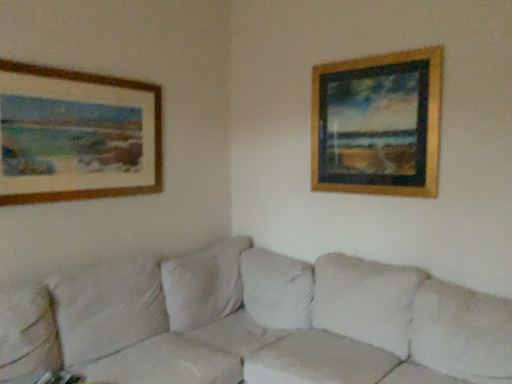
Locate an element on the screen. This screenshot has height=384, width=512. white fabric couch at center is located at coordinates tap(254, 323).

Image resolution: width=512 pixels, height=384 pixels. Find the location of `white fabric couch at center`. white fabric couch at center is located at coordinates (254, 323).

Is wooden picture frame at upper left, placed as the 1th picture frame when sorted from left to right, shorter than white fabric couch at center?

Yes, wooden picture frame at upper left, placed as the 1th picture frame when sorted from left to right, is shorter than white fabric couch at center.

From a real-world perspective, is wooden picture frame at upper left, which is the second picture frame in right-to-left order, positioned above or below white fabric couch at center?

In terms of real-world spatial position, wooden picture frame at upper left, which is the second picture frame in right-to-left order, is above white fabric couch at center.

Is wooden picture frame at upper left, which is the second picture frame in right-to-left order, located outside white fabric couch at center?

Yes.

Is white fabric couch at center spatially inside gold wooden picture frame at upper right, the first picture frame positioned from the right, or outside of it?

white fabric couch at center exists outside the volume of gold wooden picture frame at upper right, the first picture frame positioned from the right.

Find the location of a particular element. studio couch below the gold wooden picture frame at upper right, the 2th picture frame positioned from the left (from the image's perspective) is located at coordinates (254, 323).

Which object is wider, white fabric couch at center or gold wooden picture frame at upper right, the 2th picture frame positioned from the left?

Wider between the two is white fabric couch at center.

Does white fabric couch at center lie behind gold wooden picture frame at upper right, the first picture frame positioned from the right?

That is False.

Is gold wooden picture frame at upper right, the 2th picture frame positioned from the left, inside the boundaries of wooden picture frame at upper left, placed as the 1th picture frame when sorted from left to right, or outside?

gold wooden picture frame at upper right, the 2th picture frame positioned from the left, cannot be found inside wooden picture frame at upper left, placed as the 1th picture frame when sorted from left to right.

Is gold wooden picture frame at upper right, the first picture frame positioned from the right, looking in the opposite direction of wooden picture frame at upper left, placed as the 1th picture frame when sorted from left to right?

No, gold wooden picture frame at upper right, the first picture frame positioned from the right,'s orientation is not away from wooden picture frame at upper left, placed as the 1th picture frame when sorted from left to right.

Which object is positioned more to the right, gold wooden picture frame at upper right, the first picture frame positioned from the right, or wooden picture frame at upper left, which is the second picture frame in right-to-left order?

From the viewer's perspective, gold wooden picture frame at upper right, the first picture frame positioned from the right, appears more on the right side.

What's the angular difference between gold wooden picture frame at upper right, the first picture frame positioned from the right, and wooden picture frame at upper left, placed as the 1th picture frame when sorted from left to right,'s facing directions?

They differ by 90.1 degrees in their facing directions.

Between white fabric couch at center and wooden picture frame at upper left, placed as the 1th picture frame when sorted from left to right, which one has less height?

With less height is wooden picture frame at upper left, placed as the 1th picture frame when sorted from left to right.

Is white fabric couch at center in front of or behind wooden picture frame at upper left, which is the second picture frame in right-to-left order, in the image?

Clearly, white fabric couch at center is in front of wooden picture frame at upper left, which is the second picture frame in right-to-left order.

Would you say white fabric couch at center contains wooden picture frame at upper left, which is the second picture frame in right-to-left order?

No, wooden picture frame at upper left, which is the second picture frame in right-to-left order, is located outside of white fabric couch at center.

From the image's perspective, which is below, white fabric couch at center or wooden picture frame at upper left, placed as the 1th picture frame when sorted from left to right?

white fabric couch at center.

Which object is wider, wooden picture frame at upper left, which is the second picture frame in right-to-left order, or gold wooden picture frame at upper right, the 2th picture frame positioned from the left?

gold wooden picture frame at upper right, the 2th picture frame positioned from the left, is wider.

Does wooden picture frame at upper left, which is the second picture frame in right-to-left order, have a lesser height compared to gold wooden picture frame at upper right, the first picture frame positioned from the right?

Yes, wooden picture frame at upper left, which is the second picture frame in right-to-left order, is shorter than gold wooden picture frame at upper right, the first picture frame positioned from the right.

Where is `picture frame below the gold wooden picture frame at upper right, the first picture frame positioned from the right (from a real-world perspective)`? Image resolution: width=512 pixels, height=384 pixels. picture frame below the gold wooden picture frame at upper right, the first picture frame positioned from the right (from a real-world perspective) is located at coordinates (76, 135).

How many degrees apart are the facing directions of gold wooden picture frame at upper right, the 2th picture frame positioned from the left, and white fabric couch at center?

They differ by 90.7 degrees in their facing directions.

Considering the relative sizes of gold wooden picture frame at upper right, the 2th picture frame positioned from the left, and white fabric couch at center in the image provided, is gold wooden picture frame at upper right, the 2th picture frame positioned from the left, thinner than white fabric couch at center?

Yes.

Where is `studio couch that appears in front of the gold wooden picture frame at upper right, the first picture frame positioned from the right`? The height and width of the screenshot is (384, 512). studio couch that appears in front of the gold wooden picture frame at upper right, the first picture frame positioned from the right is located at coordinates click(x=254, y=323).

I want to click on studio couch in front of the wooden picture frame at upper left, placed as the 1th picture frame when sorted from left to right, so click(x=254, y=323).

In the image, there is a gold wooden picture frame at upper right, the 2th picture frame positioned from the left. Where is `studio couch below it (from a real-world perspective)`? Image resolution: width=512 pixels, height=384 pixels. studio couch below it (from a real-world perspective) is located at coordinates (254, 323).

When comparing their distances from white fabric couch at center, does wooden picture frame at upper left, placed as the 1th picture frame when sorted from left to right, or gold wooden picture frame at upper right, the 2th picture frame positioned from the left, seem closer?

wooden picture frame at upper left, placed as the 1th picture frame when sorted from left to right.

Which object lies nearer to the anchor point wooden picture frame at upper left, placed as the 1th picture frame when sorted from left to right, white fabric couch at center or gold wooden picture frame at upper right, the 2th picture frame positioned from the left?

Among the two, white fabric couch at center is located nearer to wooden picture frame at upper left, placed as the 1th picture frame when sorted from left to right.

Looking at the image, which one is located further to wooden picture frame at upper left, which is the second picture frame in right-to-left order, gold wooden picture frame at upper right, the first picture frame positioned from the right, or white fabric couch at center?

The object further to wooden picture frame at upper left, which is the second picture frame in right-to-left order, is gold wooden picture frame at upper right, the first picture frame positioned from the right.

When comparing their distances from gold wooden picture frame at upper right, the first picture frame positioned from the right, does wooden picture frame at upper left, placed as the 1th picture frame when sorted from left to right, or white fabric couch at center seem closer?

Based on the image, white fabric couch at center appears to be nearer to gold wooden picture frame at upper right, the first picture frame positioned from the right.

Estimate the real-world distances between objects in this image. Which object is further from white fabric couch at center, gold wooden picture frame at upper right, the 2th picture frame positioned from the left, or wooden picture frame at upper left, which is the second picture frame in right-to-left order?

gold wooden picture frame at upper right, the 2th picture frame positioned from the left, lies further to white fabric couch at center than the other object.

Estimate the real-world distances between objects in this image. Which object is further from gold wooden picture frame at upper right, the first picture frame positioned from the right, white fabric couch at center or wooden picture frame at upper left, which is the second picture frame in right-to-left order?

wooden picture frame at upper left, which is the second picture frame in right-to-left order, is further to gold wooden picture frame at upper right, the first picture frame positioned from the right.

The width and height of the screenshot is (512, 384). Identify the location of studio couch between wooden picture frame at upper left, which is the second picture frame in right-to-left order, and gold wooden picture frame at upper right, the 2th picture frame positioned from the left. (254, 323).